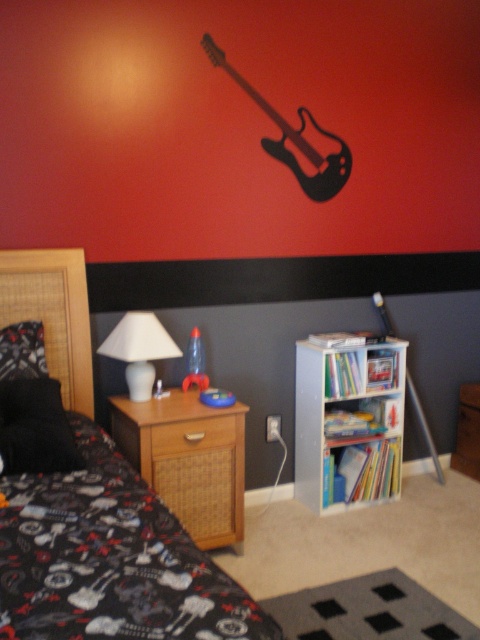
Question: Does white matte lamp at left have a smaller size compared to woven wood drawer at lower left?

Choices:
 (A) no
 (B) yes

Answer: (A)

Question: Among these points, which one is farthest from the camera?

Choices:
 (A) (192, 380)
 (B) (177, 436)
 (C) (122, 317)

Answer: (A)

Question: Is black matte guitar at upper center further to camera compared to white matte lamp at left?

Choices:
 (A) yes
 (B) no

Answer: (A)

Question: Observing the image, what is the correct spatial positioning of black fabric bed at center in reference to black matte guitar at upper center?

Choices:
 (A) right
 (B) left

Answer: (B)

Question: Which object is the closest to the black matte guitar at upper center?

Choices:
 (A) woven wood drawer at lower left
 (B) woven wood nightstand at lower left

Answer: (A)

Question: Estimate the real-world distances between objects in this image. Which object is closer to the woven wood drawer at lower left?

Choices:
 (A) black matte guitar at upper center
 (B) woven wood nightstand at lower left
 (C) black fabric bed at center
 (D) translucent plastic toy at center

Answer: (B)